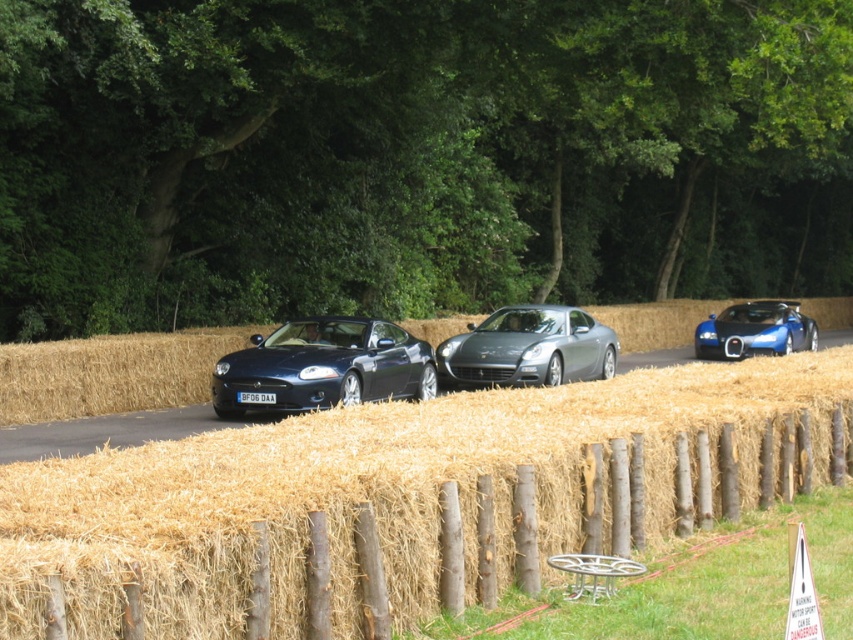
Question: Is glossy metallic car at center thinner than satin silver car at center?

Choices:
 (A) yes
 (B) no

Answer: (A)

Question: Does wooden post fence at center have a greater width compared to blue glossy sports car at right?

Choices:
 (A) no
 (B) yes

Answer: (A)

Question: Which object is the closest to the wooden post fence at center?

Choices:
 (A) blue glossy sports car at right
 (B) satin silver car at center
 (C) glossy metallic car at center

Answer: (C)

Question: Is wooden post fence at center positioned at the back of satin silver car at center?

Choices:
 (A) no
 (B) yes

Answer: (A)

Question: Which object is positioned farthest from the glossy metallic car at center?

Choices:
 (A) blue glossy sports car at right
 (B) satin silver car at center
 (C) wooden post fence at center

Answer: (A)

Question: Estimate the real-world distances between objects in this image. Which object is closer to the glossy metallic car at center?

Choices:
 (A) satin silver car at center
 (B) wooden post fence at center

Answer: (A)